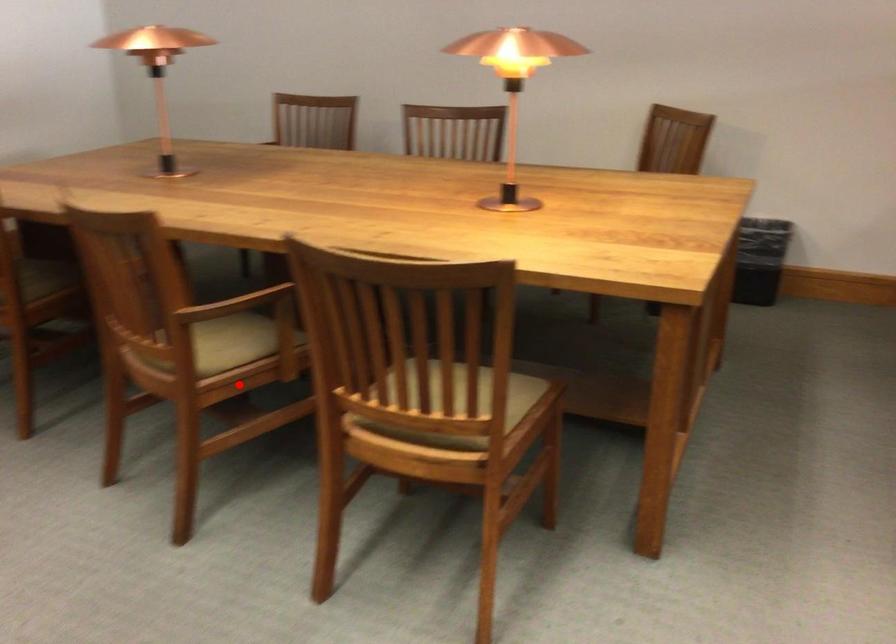
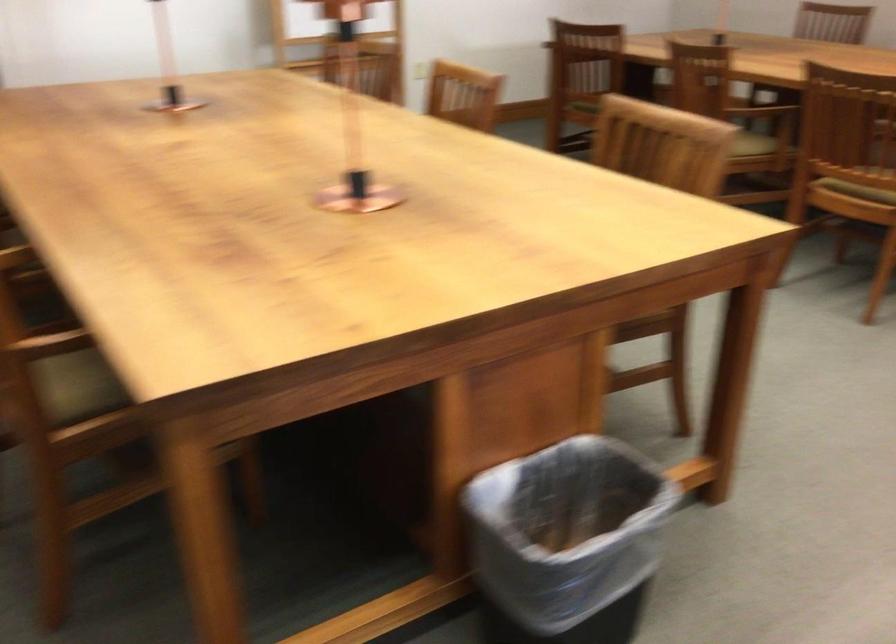
The point at the highlighted location is marked in the first image. Where is the corresponding point in the second image?

(753, 144)